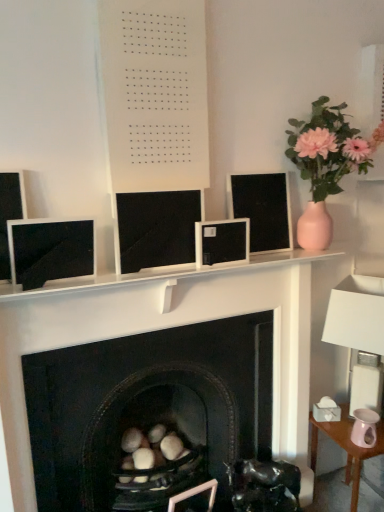
Question: Is black matte fireplace at center at the right side of matte black monitor at left, which is counted as the 4th computer monitor, starting from the right?

Choices:
 (A) yes
 (B) no

Answer: (A)

Question: Can you confirm if black matte fireplace at center is thinner than matte black monitor at left, the first computer monitor positioned from the left?

Choices:
 (A) no
 (B) yes

Answer: (A)

Question: Does black matte fireplace at center turn towards matte black monitor at left, the first computer monitor positioned from the left?

Choices:
 (A) no
 (B) yes

Answer: (A)

Question: Considering the relative sizes of black matte fireplace at center and matte black monitor at left, the first computer monitor positioned from the left, in the image provided, is black matte fireplace at center bigger than matte black monitor at left, the first computer monitor positioned from the left,?

Choices:
 (A) yes
 (B) no

Answer: (A)

Question: Is black matte fireplace at center to the left of matte black monitor at left, which is counted as the 4th computer monitor, starting from the right, from the viewer's perspective?

Choices:
 (A) yes
 (B) no

Answer: (B)

Question: Are black matte fireplace at center and matte black monitor at left, the first computer monitor positioned from the left, making contact?

Choices:
 (A) yes
 (B) no

Answer: (B)

Question: Does pink ceramic table at lower right come behind black matte fireplace at center?

Choices:
 (A) yes
 (B) no

Answer: (A)

Question: Is pink ceramic table at lower right positioned before black matte fireplace at center?

Choices:
 (A) yes
 (B) no

Answer: (B)

Question: From the image's perspective, is pink ceramic table at lower right on top of black matte fireplace at center?

Choices:
 (A) yes
 (B) no

Answer: (B)

Question: Is pink ceramic table at lower right not close to black matte fireplace at center?

Choices:
 (A) yes
 (B) no

Answer: (B)

Question: Considering the relative sizes of pink ceramic table at lower right and black matte fireplace at center in the image provided, is pink ceramic table at lower right bigger than black matte fireplace at center?

Choices:
 (A) no
 (B) yes

Answer: (A)

Question: Is pink ceramic table at lower right oriented away from black matte fireplace at center?

Choices:
 (A) yes
 (B) no

Answer: (B)

Question: Are black matte monitor at center, the 3th computer monitor in the right-to-left sequence, and white matte board at upper center making contact?

Choices:
 (A) yes
 (B) no

Answer: (B)